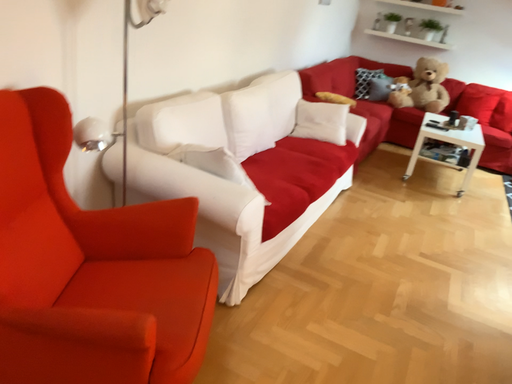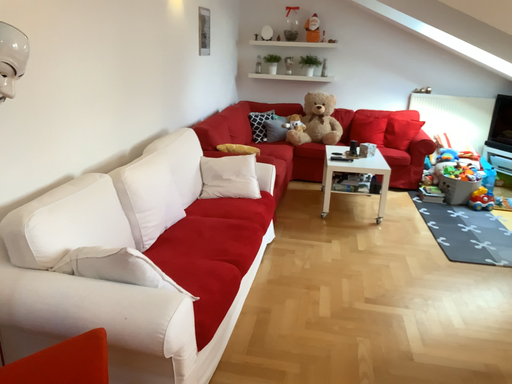
Question: Which way did the camera rotate in the video?

Choices:
 (A) rotated downward
 (B) rotated upward

Answer: (B)